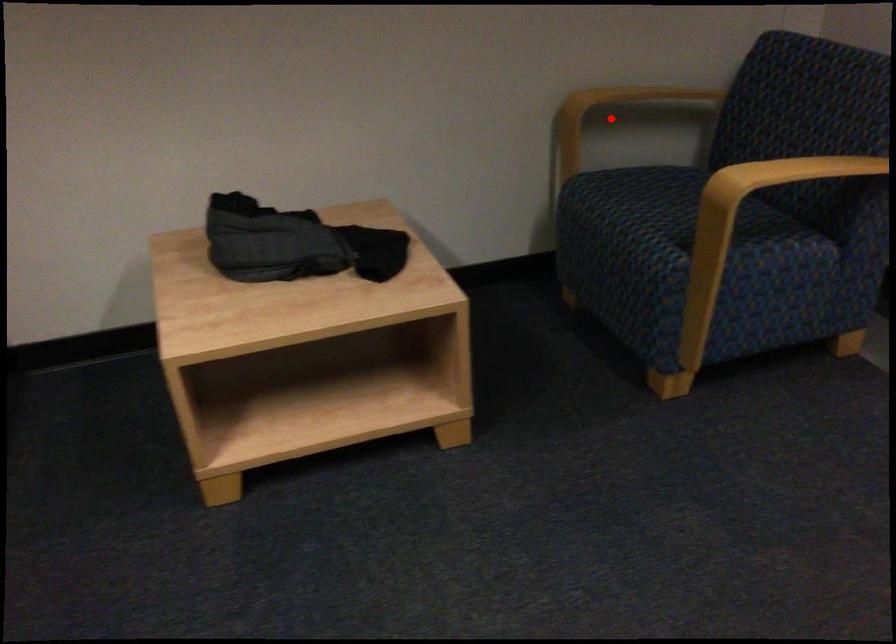
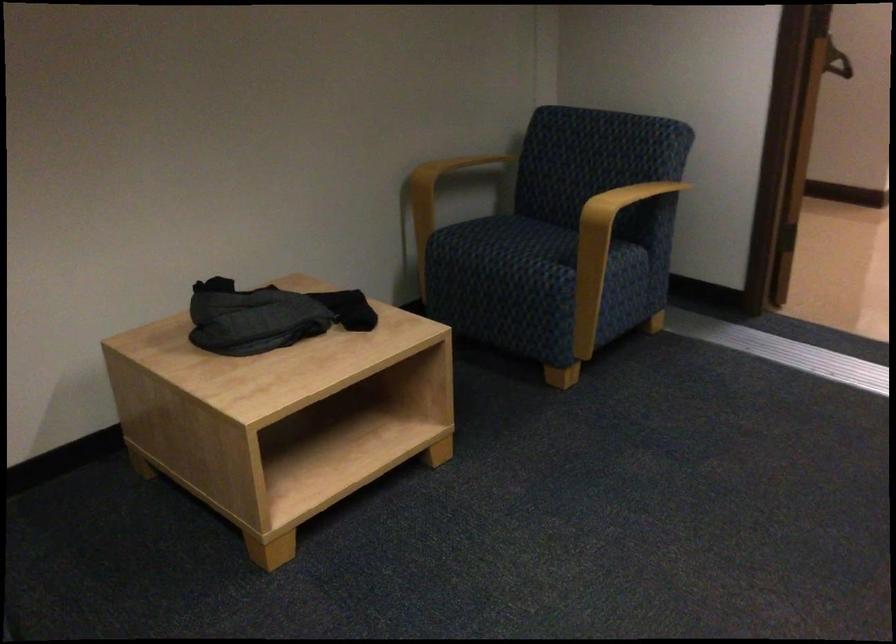
Question: I am providing you with two images of the same scene from different viewpoints. Image1 has a red point marked. In image2, the corresponding 3D location appears at what relative position? Reply with the corresponding letter.

Choices:
 (A) Closer
 (B) Farther

Answer: (B)